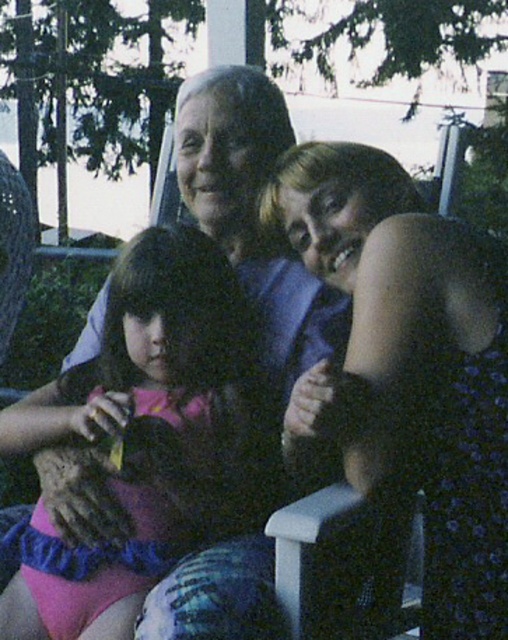
Between matte blue dress at center and pink fabric dress at center, which one appears on the right side from the viewer's perspective?

From the viewer's perspective, matte blue dress at center appears more on the right side.

Who is higher up, matte blue dress at center or pink fabric dress at center?

matte blue dress at center is above.

What do you see at coordinates (414, 360) in the screenshot?
I see `matte blue dress at center` at bounding box center [414, 360].

Find the location of a particular element. matte blue dress at center is located at coordinates (414, 360).